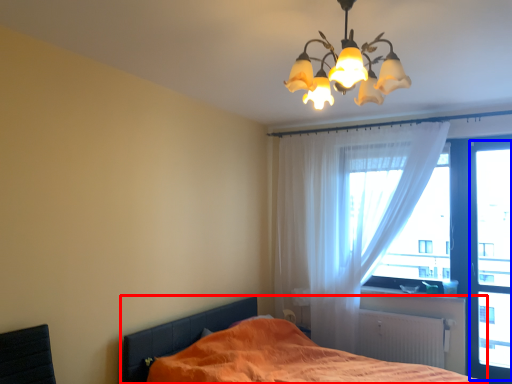
Question: Which object appears closest to the camera in this image, bed (highlighted by a red box) or window screen (highlighted by a blue box)?

Choices:
 (A) bed
 (B) window screen

Answer: (A)